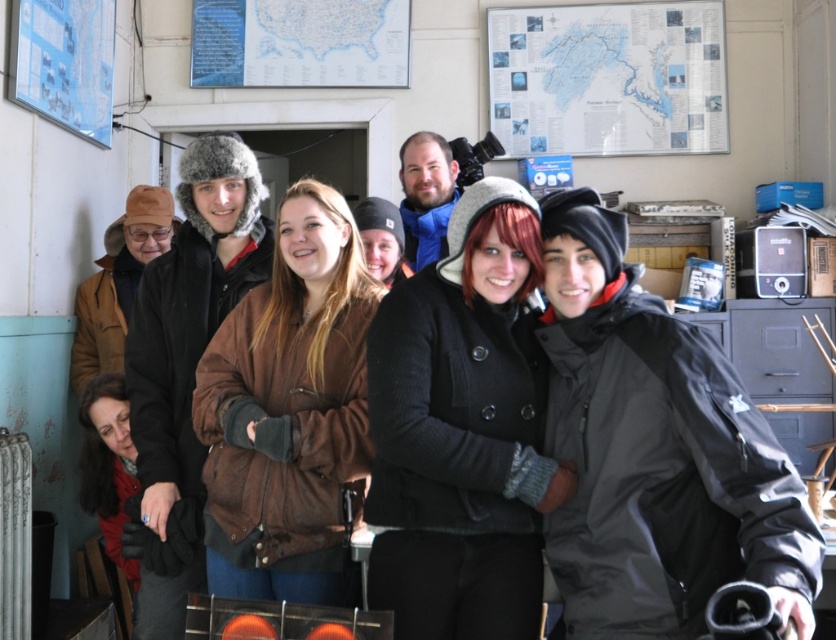
You are standing in the room and want to move from the point at coordinates (x=622, y=324) to the point at coordinates (x=376, y=608). Which direction should you move in to get closer to your destination?

Result: To move from point (x=622, y=324) to point (x=376, y=608), you should move towards the lower right direction since point (x=376, y=608) is further away from the viewer compared to the starting point.

You are standing in the room and want to put your black wool coat at center on the floor. Where should you place it?

You should place it at point (x=462, y=432).